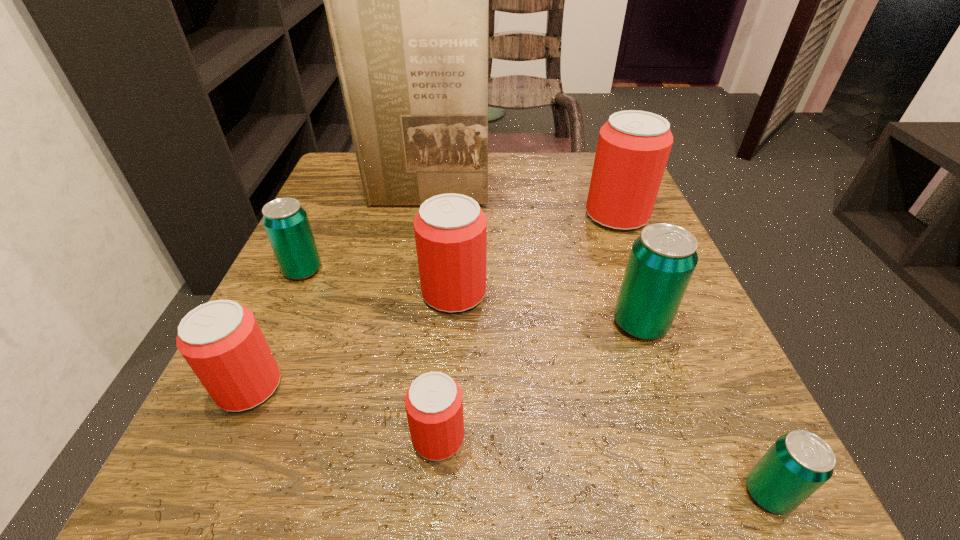
Find the location of `blank space at the near right corner of the desktop`. blank space at the near right corner of the desktop is located at coordinates (752, 442).

Image resolution: width=960 pixels, height=540 pixels. Find the location of `free spot between the third nearest red beer can and the second nearest teal beer can`. free spot between the third nearest red beer can and the second nearest teal beer can is located at coordinates (547, 308).

At what (x,y) coordinates should I click in order to perform the action: click on vacant space that's between the phonebook and the seventh shortest object. Please return your answer as a coordinate pair (x, y). The image size is (960, 540). Looking at the image, I should click on (521, 206).

At what (x,y) coordinates should I click in order to perform the action: click on vacant area that lies between the biggest teal beer can and the leftmost red beer can. Please return your answer as a coordinate pair (x, y). Looking at the image, I should click on (444, 355).

At what (x,y) coordinates should I click in order to perform the action: click on vacant region between the nearest object and the seventh shortest object. Please return your answer as a coordinate pair (x, y). This screenshot has height=540, width=960. Looking at the image, I should click on (692, 354).

Image resolution: width=960 pixels, height=540 pixels. I want to click on vacant space in between the third nearest red beer can and the leftmost red beer can, so point(351,340).

What are the coordinates of `free space between the tallest object and the smallest teal beer can` in the screenshot? It's located at (597, 345).

Image resolution: width=960 pixels, height=540 pixels. What are the coordinates of `free space between the smallest red beer can and the second smallest red beer can` in the screenshot? It's located at (344, 412).

Select which object is the seventh closest to the phonebook. Please provide its 2D coordinates. Your answer should be formatted as a tuple, i.e. [(x, y)], where the tuple contains the x and y coordinates of a point satisfying the conditions above.

[(798, 463)]

Find the location of a particular element. The image size is (960, 540). object that ranks as the third closest to the third biggest red beer can is located at coordinates (450, 230).